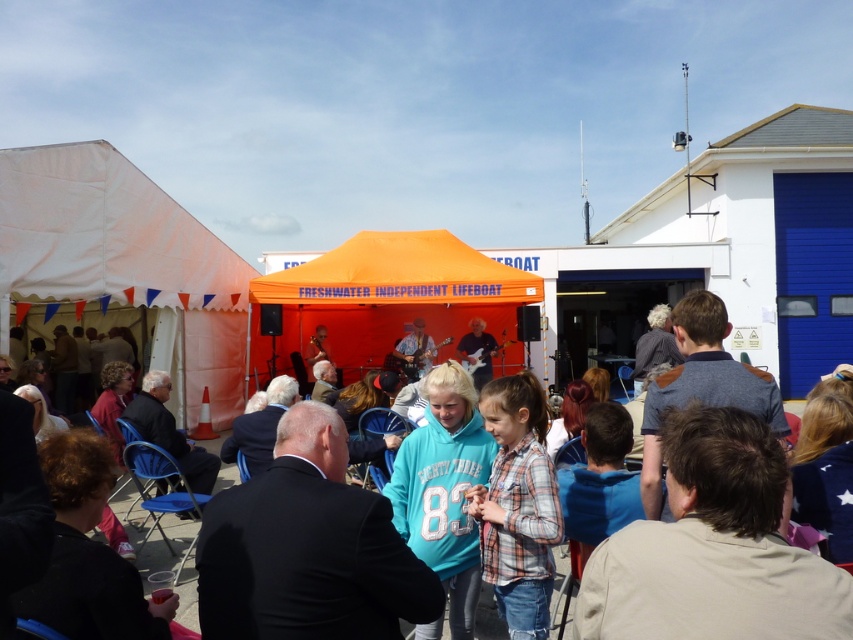
You are organizing a small workshop and need to choose between the white canvas tent at left and the orange fabric tent at center for your event. Based on the scene description, which tent would be more suitable for accommodating a larger number of participants?

The orange fabric tent at center is more suitable for accommodating a larger number of participants because it occupies more space than the white canvas tent at left.

You are a photographer at the event and want to take a photo of both the white canvas tent at left and the orange fabric tent at center. However, you need to ensure that neither tent is blocking the other in the shot. Where should you position yourself to capture both tents without any overlap?

The white canvas tent at left is in front of the orange fabric tent at center, so you should position yourself to the side of the white canvas tent at left to capture both tents without overlap.